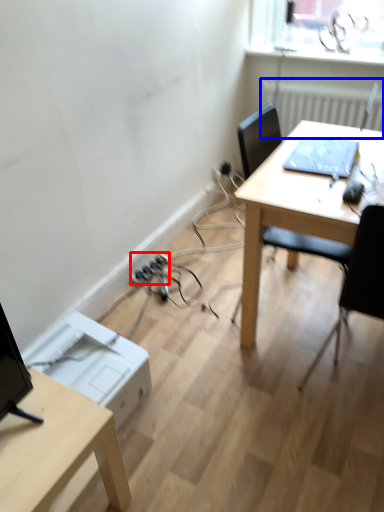
Question: Which object appears closest to the camera in this image, extension cord (highlighted by a red box) or radiator (highlighted by a blue box)?

Choices:
 (A) extension cord
 (B) radiator

Answer: (B)